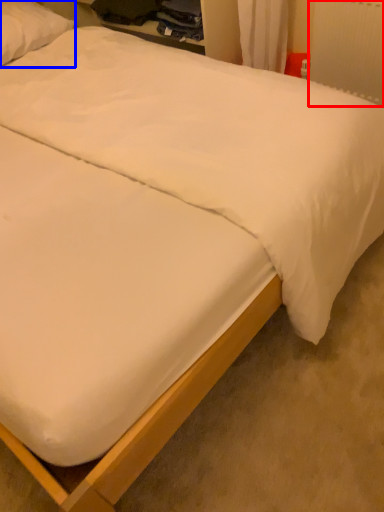
Question: Among these objects, which one is nearest to the camera, radiator (highlighted by a red box) or pillow (highlighted by a blue box)?

Choices:
 (A) radiator
 (B) pillow

Answer: (A)